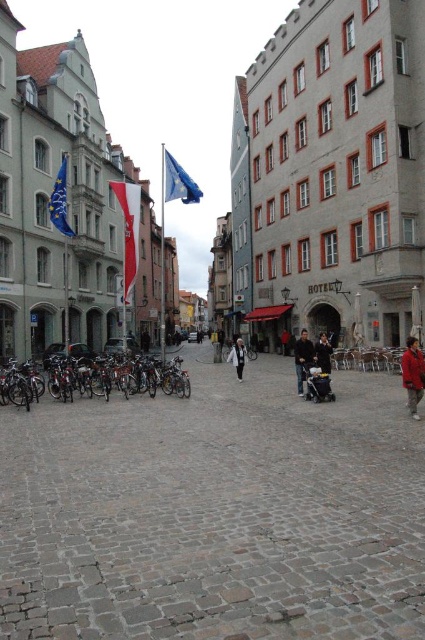
You are a tourist standing in the cobblestone square and want to take a photo of the white fabric flag at center and the dark brown leather jacket at center. Which object should you zoom in on to ensure both fit in the frame without moving your position?

The white fabric flag at center might be wider than dark brown leather jacket at center, so you should zoom in on the dark brown leather jacket at center to ensure both fit in the frame without moving your position.

You are a tourist standing in the cobblestone square and want to take a photo of both the blue fabric flag at upper center and the white cotton jacket at center. However, you need to ensure that both objects are fully visible in the frame. Given their sizes, which object might require you to adjust your camera angle or position to include it entirely in the photo?

The blue fabric flag at upper center is much taller than the white cotton jacket at center, so you might need to adjust your camera angle or position to include the taller flag entirely in the photo.